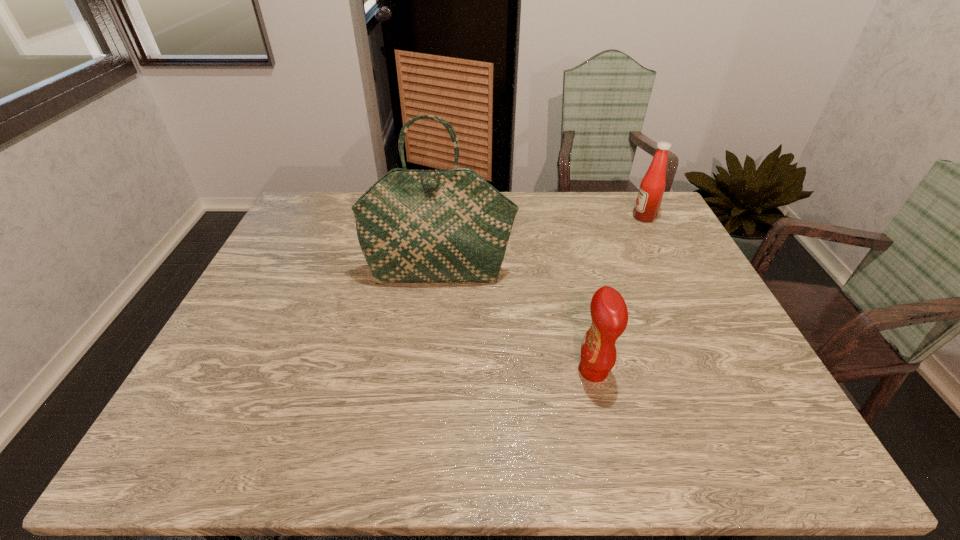
The image size is (960, 540). I want to click on free spot at the far right corner of the desktop, so click(621, 211).

Where is `free spot at the near right corner of the desktop`? The height and width of the screenshot is (540, 960). free spot at the near right corner of the desktop is located at coordinates (780, 434).

This screenshot has width=960, height=540. In order to click on free space that is in between the tote bag and the second object from left to right in this screenshot , I will do `click(516, 322)`.

Find the location of `blank region between the nearest object and the tallest object`. blank region between the nearest object and the tallest object is located at coordinates (516, 322).

At what (x,y) coordinates should I click in order to perform the action: click on free space between the right condiment and the tallest object. Please return your answer as a coordinate pair (x, y). Looking at the image, I should click on (542, 245).

What are the coordinates of `empty space that is in between the second farthest object and the rightmost object` in the screenshot? It's located at (542, 245).

Locate an element on the screen. The height and width of the screenshot is (540, 960). free space between the second farthest object and the shortest object is located at coordinates (516, 322).

Image resolution: width=960 pixels, height=540 pixels. I want to click on empty space between the farthest object and the leftmost object, so click(542, 245).

The width and height of the screenshot is (960, 540). In order to click on free space between the shortest object and the leftmost object in this screenshot , I will do `click(516, 322)`.

Locate an element on the screen. the second closest object to the tallest object is located at coordinates tap(648, 201).